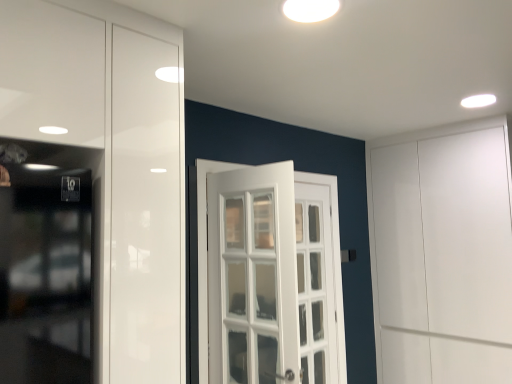
I want to click on white glossy elevator at right, so click(442, 254).

What do you see at coordinates (442, 254) in the screenshot? The image size is (512, 384). I see `white glossy elevator at right` at bounding box center [442, 254].

Where is `white glossy elevator at right`? white glossy elevator at right is located at coordinates (442, 254).